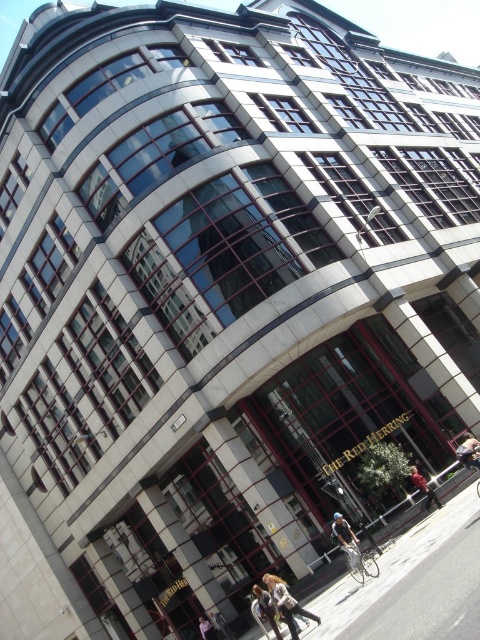
You are a delivery person who needs to deliver a package to the entrance of the building. You see a leather jacket at center and a light brown leather jacket at lower center. Which jacket is closer to the entrance?

The leather jacket at center is positioned on the right side of the light brown leather jacket at lower center, so the light brown leather jacket at lower center is closer to the entrance.

You are standing at the entrance of the building and see the leather jacket at center and the light brown leather jacket at lower center. Which one is closer to you?

The leather jacket at center is closer to you because it is in front of the light brown leather jacket at lower center.